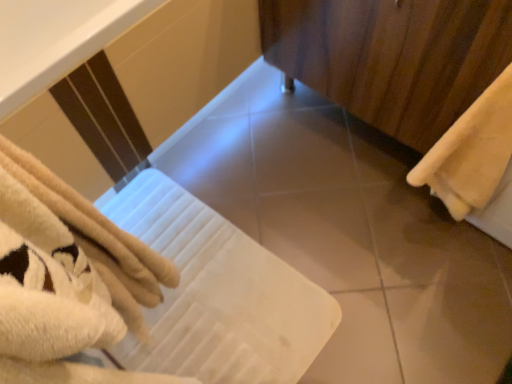
Question: In the image, is beige soft towel at right positioned in front of or behind white soft towel at center?

Choices:
 (A) front
 (B) behind

Answer: (A)

Question: Considering the relative positions of beige soft towel at right and white soft towel at center in the image provided, is beige soft towel at right to the left or to the right of white soft towel at center?

Choices:
 (A) left
 (B) right

Answer: (B)

Question: Based on their relative distances, which object is nearer to the smooth beige tile at center?

Choices:
 (A) beige soft towel at right
 (B) wooden curtain at right
 (C) white soft towel at center

Answer: (C)

Question: Which is farther from the wooden curtain at right?

Choices:
 (A) beige soft towel at right
 (B) smooth beige tile at center
 (C) white soft towel at center

Answer: (C)